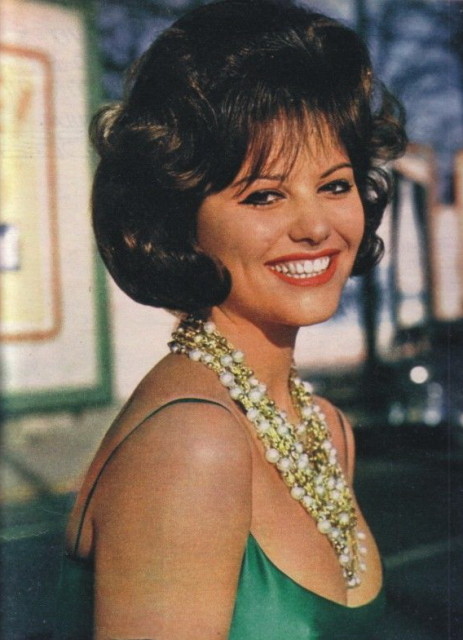
Locate an element on the screen. The image size is (463, 640). blurry artwork on left upper wall is located at coordinates coord(33,196).